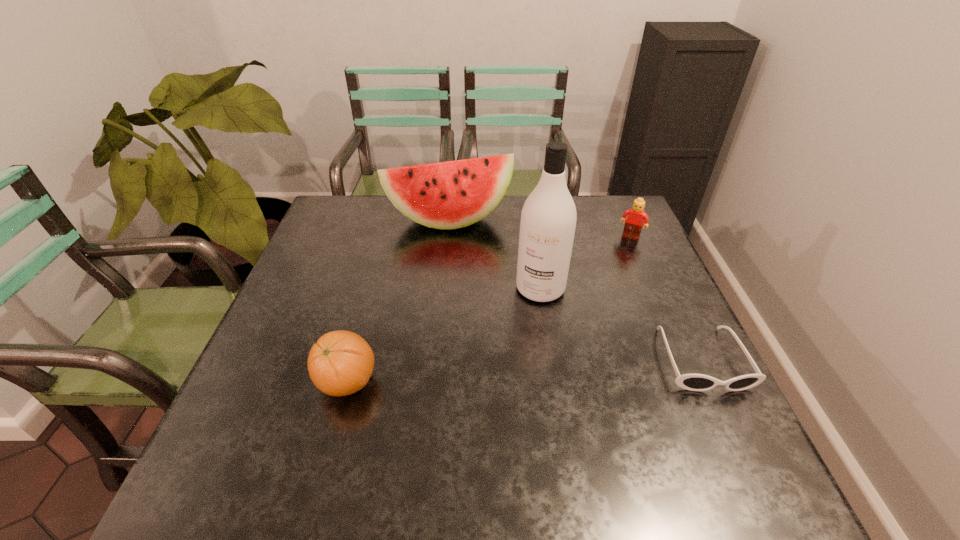
You are a GUI agent. You are given a task and a screenshot of the screen. Output one action in this format:
    pyautogui.click(x=<x>, y=<y>)
    Task: Click on the free region located on the front-facing side of the shampoo
    The width and height of the screenshot is (960, 540).
    Given the screenshot: What is the action you would take?
    pyautogui.click(x=486, y=398)

Find the location of a particular element. The width and height of the screenshot is (960, 540). vacant space positioned 0.370m on the front-facing side of the shampoo is located at coordinates (471, 426).

The width and height of the screenshot is (960, 540). What are the coordinates of `vacant region located 0.130m on the front-facing side of the shampoo` in the screenshot? It's located at (515, 340).

This screenshot has height=540, width=960. In order to click on vacant area situated 0.200m on the outer rind of the watermelon in this screenshot , I will do `click(468, 276)`.

Locate an element on the screen. vacant space positioned on the outer rind of the watermelon is located at coordinates (462, 247).

This screenshot has width=960, height=540. What are the coordinates of `free space located on the outer rind of the watermelon` in the screenshot? It's located at (479, 324).

In order to click on Lego present at the far edge in this screenshot , I will do `click(637, 216)`.

Where is `watermelon that is at the far edge`? The width and height of the screenshot is (960, 540). watermelon that is at the far edge is located at coordinates (447, 195).

This screenshot has width=960, height=540. I want to click on object located in the near edge section of the desktop, so click(340, 363).

You are a GUI agent. You are given a task and a screenshot of the screen. Output one action in this format:
    pyautogui.click(x=<x>, y=<y>)
    Task: Click on the object at the left edge
    
    Given the screenshot: What is the action you would take?
    pyautogui.click(x=340, y=363)